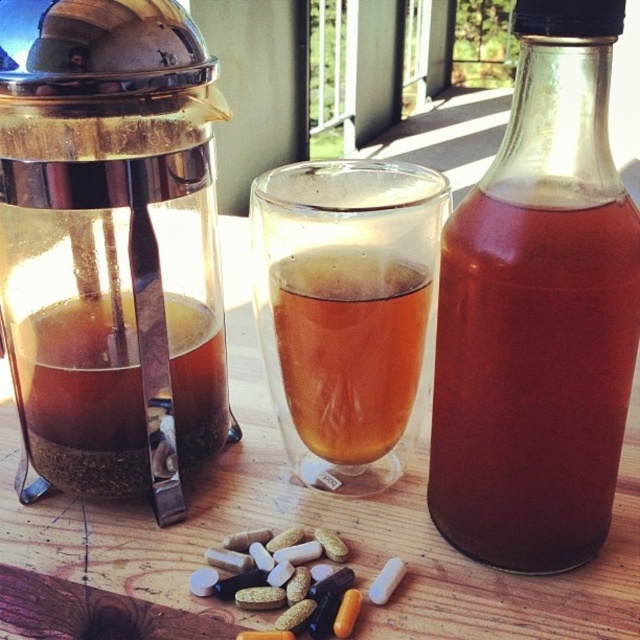
Question: Which point is closer to the camera taking this photo?

Choices:
 (A) (80, 6)
 (B) (122, 458)
 (C) (467, 250)
 (D) (381, 452)

Answer: (C)

Question: Does transparent glass coffee maker at left have a lesser width compared to translucent glass cup at center?

Choices:
 (A) no
 (B) yes

Answer: (A)

Question: Can you confirm if translucent glass bottle at center is positioned to the left of translucent glass tea at left?

Choices:
 (A) no
 (B) yes

Answer: (A)

Question: Is transparent glass coffee maker at left wider than translucent glass bottle at center?

Choices:
 (A) no
 (B) yes

Answer: (B)

Question: Estimate the real-world distances between objects in this image. Which object is closer to the translucent glass cup at center?

Choices:
 (A) transparent glass coffee maker at left
 (B) translucent glass tea at left

Answer: (B)

Question: Which point appears closest to the camera in this image?

Choices:
 (A) (460, 298)
 (B) (108, 177)
 (C) (380, 289)
 (D) (128, 422)

Answer: (A)